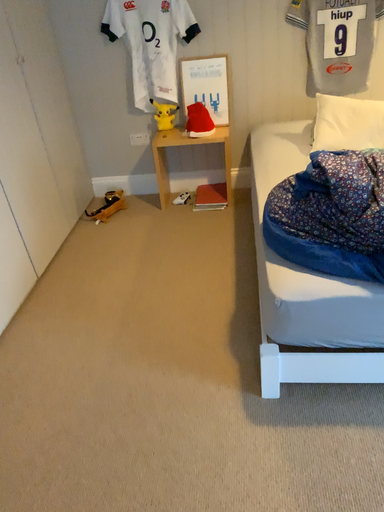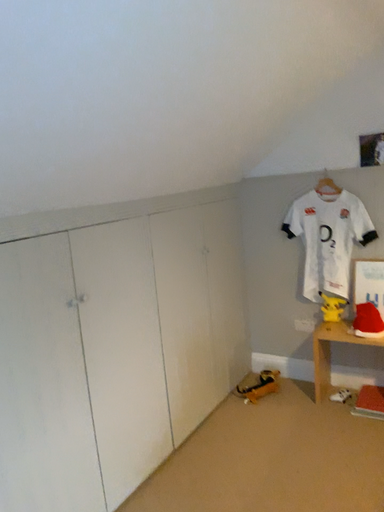
Question: How did the camera likely rotate when shooting the video?

Choices:
 (A) rotated downward
 (B) rotated upward

Answer: (B)